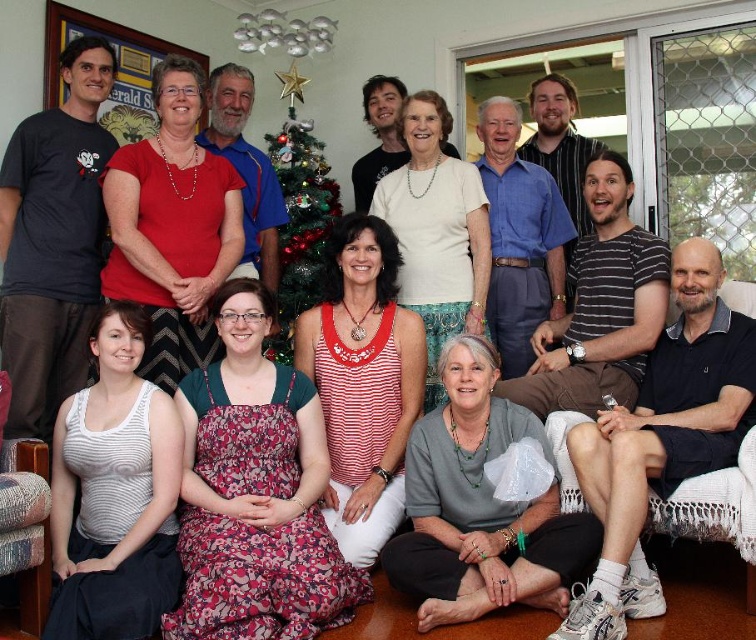
Does matte black t-shirt at left have a larger size compared to decorated christmas tree at center?

Indeed, matte black t-shirt at left has a larger size compared to decorated christmas tree at center.

The width and height of the screenshot is (756, 640). In order to click on matte black t-shirt at left in this screenshot , I will do `click(53, 240)`.